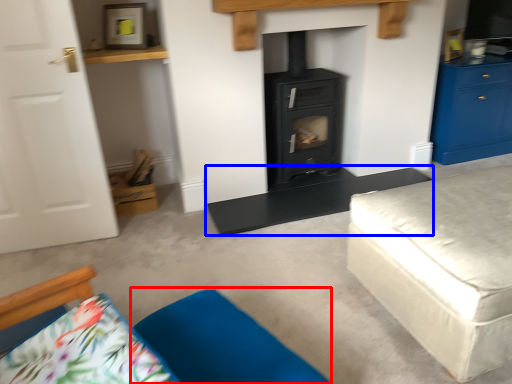
Question: Which point is further to the camera, pillow (highlighted by a red box) or table (highlighted by a blue box)?

Choices:
 (A) pillow
 (B) table

Answer: (B)